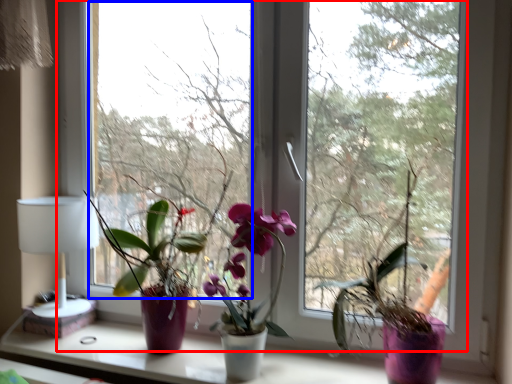
Question: Which of the following is the closest to the observer, window (highlighted by a red box) or window screen (highlighted by a blue box)?

Choices:
 (A) window
 (B) window screen

Answer: (A)